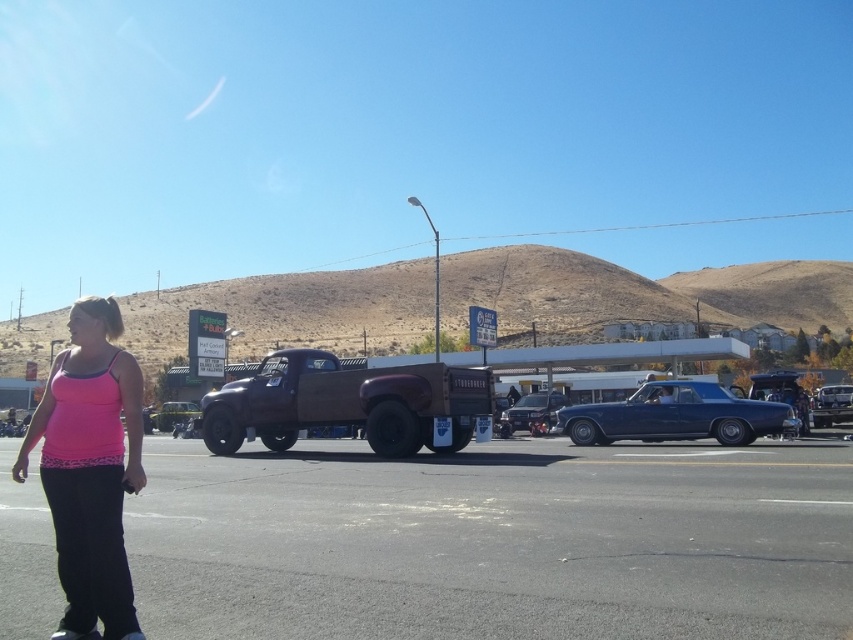
Question: Is asphalt at lower center positioned in front of pink fabric tank top at lower left?

Choices:
 (A) no
 (B) yes

Answer: (A)

Question: Does shiny maroon truck at center appear on the right side of shiny chrome truck at center?

Choices:
 (A) yes
 (B) no

Answer: (B)

Question: Which point is closer to the camera taking this photo?

Choices:
 (A) (277, 420)
 (B) (196, 410)

Answer: (A)

Question: Does shiny chrome motorcycle at center have a greater width compared to shiny metallic car at center?

Choices:
 (A) no
 (B) yes

Answer: (A)

Question: Which object is closer to the camera taking this photo?

Choices:
 (A) pink fabric tank top at lower left
 (B) shiny blue car at center

Answer: (A)

Question: Which object appears closest to the camera in this image?

Choices:
 (A) shiny maroon truck at center
 (B) pink fabric tank top at lower left
 (C) shiny chrome truck at center

Answer: (B)